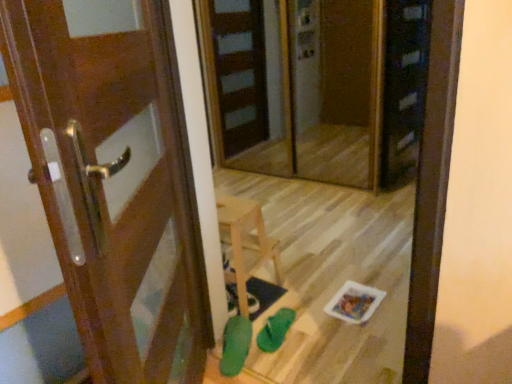
The width and height of the screenshot is (512, 384). What are the coordinates of `vacant region in front of transparent glass screen door at center` in the screenshot? It's located at (305, 220).